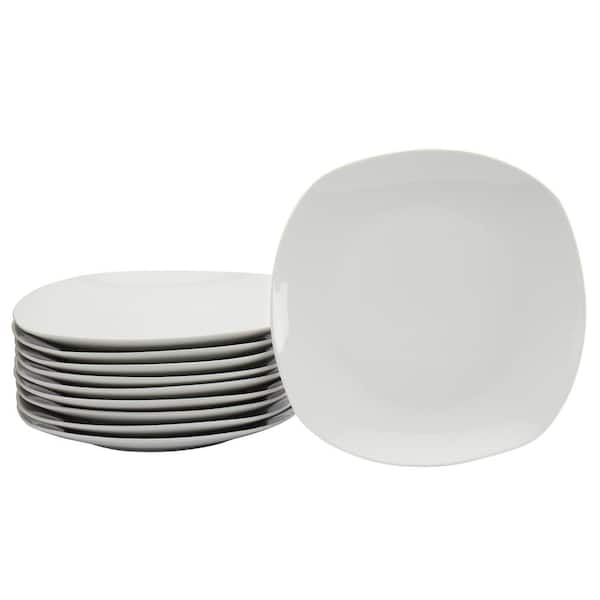
The image size is (600, 600). Find the location of `plates`. plates is located at coordinates (200, 447), (175, 431), (178, 413), (181, 401), (192, 390), (187, 377), (187, 366), (196, 353), (202, 326), (367, 347).